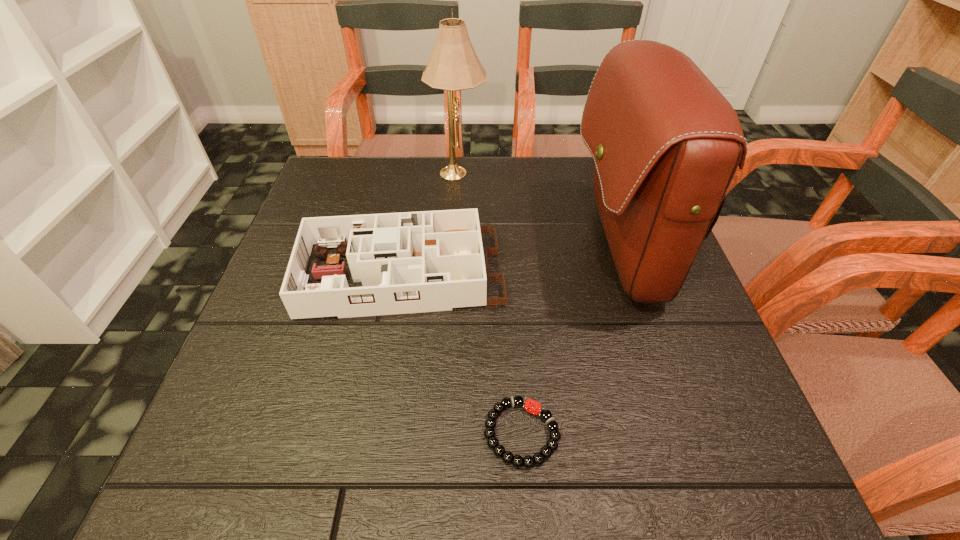
Where is `free spot between the shortest object and the third tallest object`? free spot between the shortest object and the third tallest object is located at coordinates (460, 354).

You are a GUI agent. You are given a task and a screenshot of the screen. Output one action in this format:
    pyautogui.click(x=<x>, y=<y>)
    Task: Click on the object that is the third nearest to the rightmost object
    This screenshot has height=540, width=960.
    Given the screenshot: What is the action you would take?
    pyautogui.click(x=454, y=65)

Select which object is the closest to the lampshade. Please provide its 2D coordinates. Your answer should be formatted as a tuple, i.e. [(x, y)], where the tuple contains the x and y coordinates of a point satisfying the conditions above.

[(411, 262)]

Locate an element on the screen. The width and height of the screenshot is (960, 540). free space that satisfies the following two spatial constraints: 1. on the back side of the third tallest object; 2. on the left side of the farthest object is located at coordinates (417, 171).